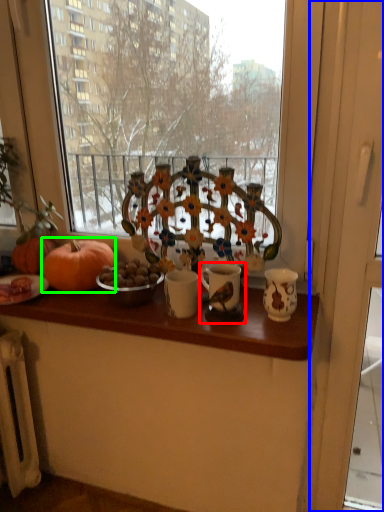
Question: Which object is the farthest from candle holder (highlighted by a red box)? Choose among these: screen door (highlighted by a blue box) or pumpkin (highlighted by a green box).

Choices:
 (A) screen door
 (B) pumpkin

Answer: (A)